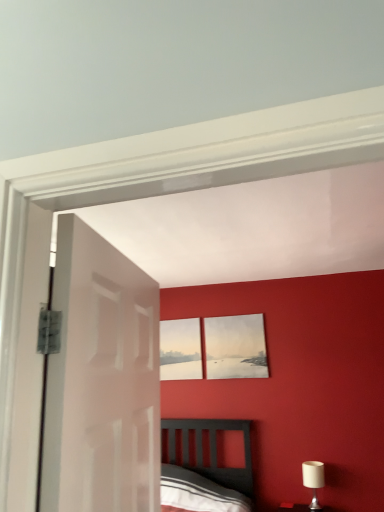
Question: Considering the relative sizes of matte gray picture frame at upper center, the first picture frame positioned from the right, and white fabric-covered lampshade at lower right in the image provided, is matte gray picture frame at upper center, the first picture frame positioned from the right, bigger than white fabric-covered lampshade at lower right?

Choices:
 (A) no
 (B) yes

Answer: (B)

Question: Can you confirm if matte gray picture frame at upper center, the first picture frame positioned from the right, is shorter than white fabric-covered lampshade at lower right?

Choices:
 (A) no
 (B) yes

Answer: (A)

Question: From the image's perspective, is matte gray picture frame at upper center, the second picture frame positioned from the left, above white fabric-covered lampshade at lower right?

Choices:
 (A) yes
 (B) no

Answer: (A)

Question: Does matte gray picture frame at upper center, the first picture frame positioned from the right, have a lesser width compared to white fabric-covered lampshade at lower right?

Choices:
 (A) no
 (B) yes

Answer: (B)

Question: From a real-world perspective, is matte gray picture frame at upper center, the first picture frame positioned from the right, beneath white fabric-covered lampshade at lower right?

Choices:
 (A) yes
 (B) no

Answer: (B)

Question: Considering the relative sizes of matte white picture frame at center, the second picture frame positioned from the right, and white glossy door at left in the image provided, is matte white picture frame at center, the second picture frame positioned from the right, thinner than white glossy door at left?

Choices:
 (A) no
 (B) yes

Answer: (B)

Question: Does matte white picture frame at center, the second picture frame positioned from the right, come in front of white glossy door at left?

Choices:
 (A) no
 (B) yes

Answer: (A)

Question: From a real-world perspective, is matte white picture frame at center, the second picture frame positioned from the right, below white glossy door at left?

Choices:
 (A) no
 (B) yes

Answer: (A)

Question: Is matte white picture frame at center, the second picture frame positioned from the right, shorter than white glossy door at left?

Choices:
 (A) yes
 (B) no

Answer: (A)

Question: Does matte white picture frame at center, the 1th picture frame positioned from the left, lie behind white glossy door at left?

Choices:
 (A) no
 (B) yes

Answer: (B)

Question: Is matte white picture frame at center, the 1th picture frame positioned from the left, bigger than white glossy door at left?

Choices:
 (A) no
 (B) yes

Answer: (A)

Question: Does white glossy door at left come behind white fabric-covered lampshade at lower right?

Choices:
 (A) no
 (B) yes

Answer: (A)